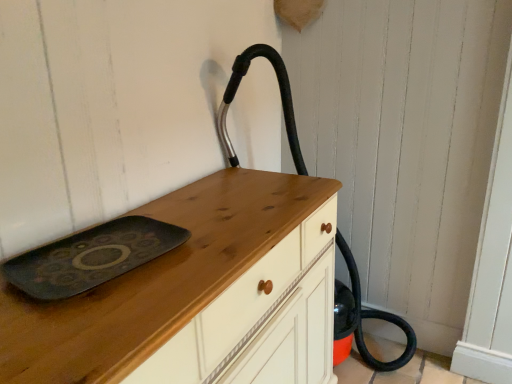
You are a GUI agent. You are given a task and a screenshot of the screen. Output one action in this format:
    pyautogui.click(x=<x>, y=<y>)
    Task: Click on the vacant area located to the right-hand side of matte black tray at center
    The width and height of the screenshot is (512, 384).
    Given the screenshot: What is the action you would take?
    pyautogui.click(x=216, y=250)